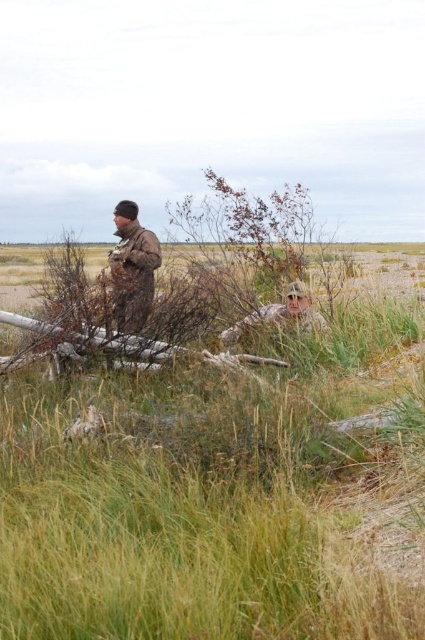
Question: Considering the relative positions of green grassy at center and camouflage fabric at center in the image provided, where is green grassy at center located with respect to camouflage fabric at center?

Choices:
 (A) above
 (B) below

Answer: (B)

Question: Which object is positioned farthest from the camouflage fabric at center?

Choices:
 (A) green grassy at center
 (B) camouflage jacket at left

Answer: (A)

Question: Is green grassy at center in front of camouflage jacket at left?

Choices:
 (A) yes
 (B) no

Answer: (A)

Question: Which point is closer to the camera?

Choices:
 (A) (124, 275)
 (B) (283, 320)
 (C) (170, 522)

Answer: (C)

Question: Does green grassy at center have a smaller size compared to camouflage fabric at center?

Choices:
 (A) yes
 (B) no

Answer: (B)

Question: Based on their relative distances, which object is farther from the camouflage fabric at center?

Choices:
 (A) green grassy at center
 (B) camouflage jacket at left

Answer: (A)